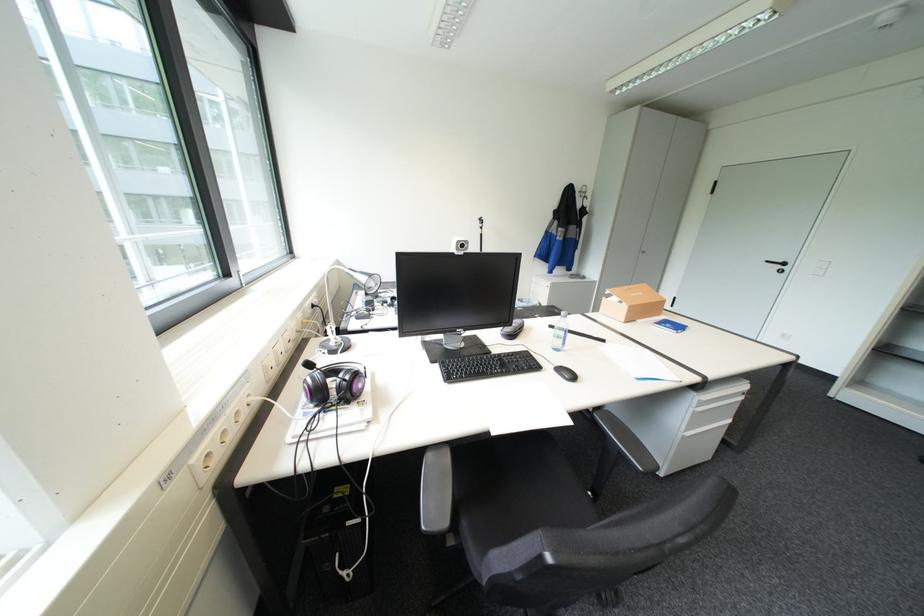
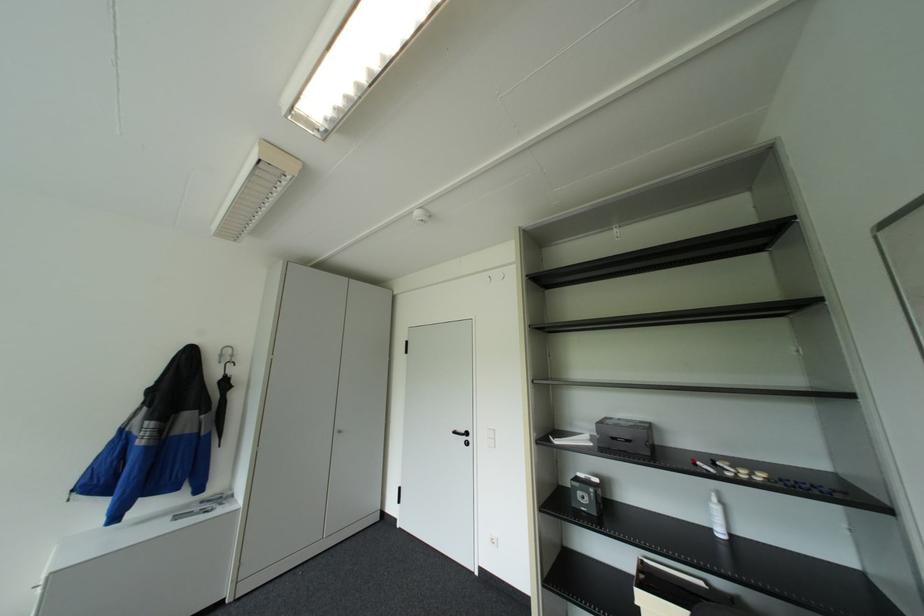
In the second image, find the point that corresponds to the point at 775,261 in the first image.

(463, 431)